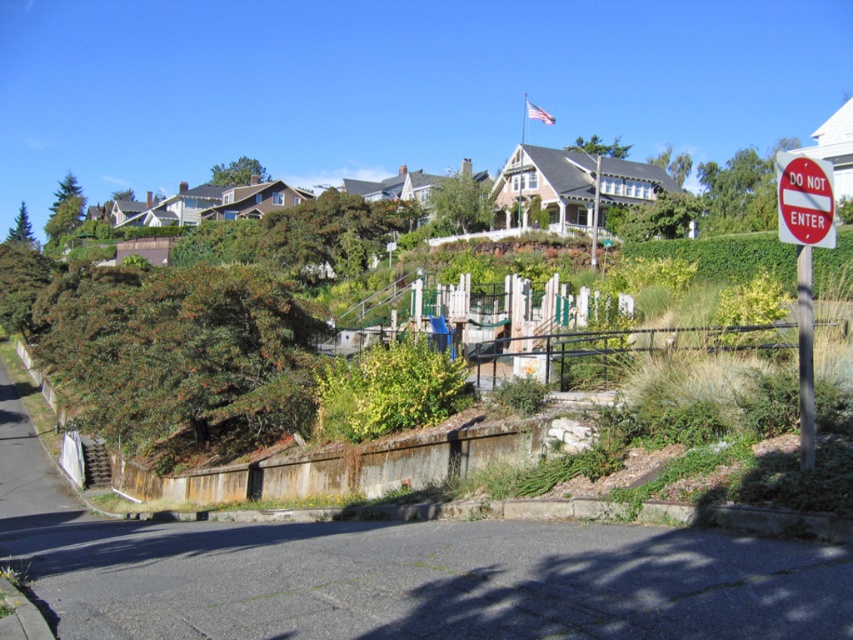
Consider the image. You are a pedestrian walking along the road and see both the red plastic sign at right and the white plastic signpost at right. Which one is positioned higher relative to the ground?

The red plastic sign at right is positioned higher than the white plastic signpost at right because it is above it.

You are a city planner reviewing the suburban area and need to install a new traffic light. The traffic light requires a base that is 1.5 meters wide. Given the red plastic sign at right and the white plastic signpost at right, which one can accommodate the traffic light base without exceeding its width?

The red plastic sign at right has a larger width than the white plastic signpost at right. Since the traffic light base requires 1.5 meters, the red plastic sign at right is the better option as it can accommodate the width needed.

You are a pedestrian walking along the road and see the red plastic sign at right and the white plastic signpost at right. Which one is bigger?

The red plastic sign at right is larger in size compared to the white plastic signpost at right.